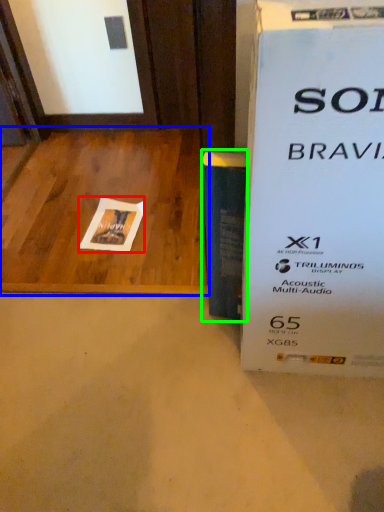
Question: Based on their relative distances, which object is farther from flyer (highlighted by a red box)? Choose from table (highlighted by a blue box) and paperback book (highlighted by a green box).

Choices:
 (A) table
 (B) paperback book

Answer: (B)